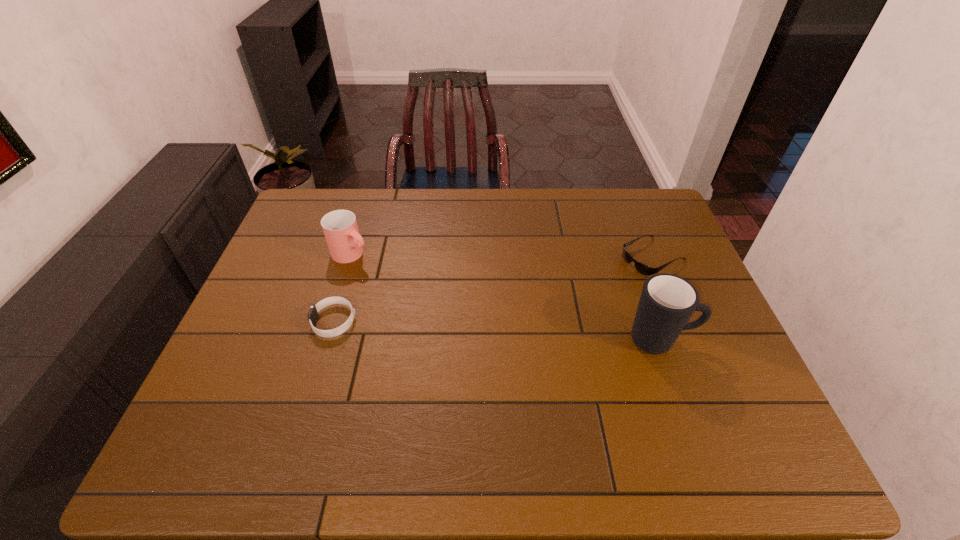
What are the coordinates of `free space located on the front-facing side of the sunglasses` in the screenshot? It's located at (579, 294).

The height and width of the screenshot is (540, 960). I want to click on vacant position located 0.260m on the front-facing side of the sunglasses, so pos(563,302).

I want to click on vacant space located on the front-facing side of the sunglasses, so click(x=600, y=283).

The height and width of the screenshot is (540, 960). Identify the location of mug that is positioned at the right edge. (667, 302).

Locate an element on the screen. The height and width of the screenshot is (540, 960). sunglasses that is at the right edge is located at coordinates (646, 270).

In the image, there is a desktop. Identify the location of vacant area at the far edge. The height and width of the screenshot is (540, 960). (510, 219).

Image resolution: width=960 pixels, height=540 pixels. Identify the location of vacant space at the near edge of the desktop. point(558,399).

I want to click on free location at the left edge of the desktop, so click(306, 281).

In the image, there is a desktop. Where is `free space at the right edge`? The image size is (960, 540). free space at the right edge is located at coordinates (670, 250).

This screenshot has width=960, height=540. Identify the location of vacant space at the far left corner of the desktop. (317, 191).